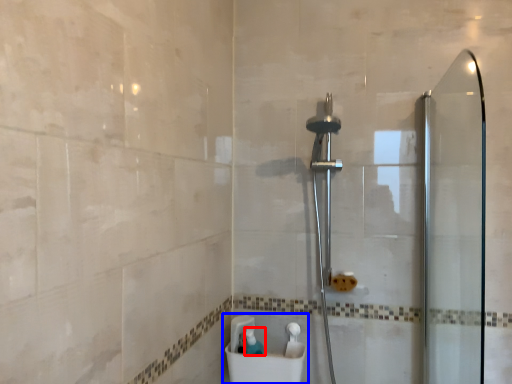
Question: Which of the following is the farthest to the observer, toiletry (highlighted by a red box) or sink (highlighted by a blue box)?

Choices:
 (A) toiletry
 (B) sink

Answer: (A)